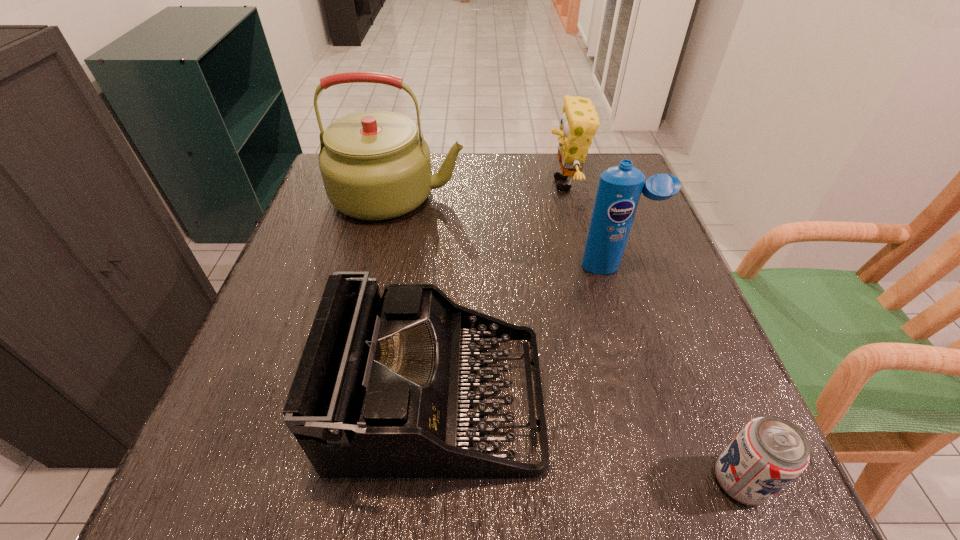
Locate an element on the screen. beer can that is at the right edge is located at coordinates (769, 452).

Locate an element on the screen. The height and width of the screenshot is (540, 960). object that is at the far left corner is located at coordinates (374, 165).

Locate an element on the screen. object that is at the far right corner is located at coordinates (579, 122).

This screenshot has height=540, width=960. Find the location of `object that is positioned at the near right corner`. object that is positioned at the near right corner is located at coordinates (769, 452).

Locate an element on the screen. The image size is (960, 540). vacant space at the far edge of the desktop is located at coordinates (477, 167).

The width and height of the screenshot is (960, 540). In order to click on free space at the near edge of the desktop in this screenshot , I will do `click(554, 449)`.

Find the location of a particular element. The height and width of the screenshot is (540, 960). vacant region at the left edge of the desktop is located at coordinates (292, 347).

The width and height of the screenshot is (960, 540). I want to click on vacant space at the right edge of the desktop, so click(633, 373).

In order to click on vacant space at the near left corner of the desktop in this screenshot , I will do `click(202, 476)`.

Locate an element on the screen. The height and width of the screenshot is (540, 960). vacant region at the far right corner is located at coordinates (594, 199).